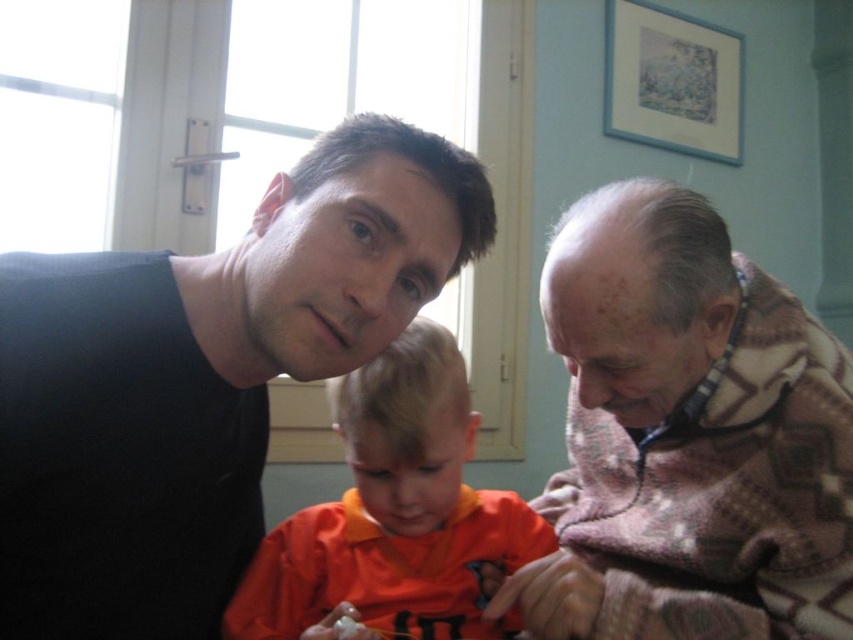
You are trying to determine which of the two knitted items is closer to you in the image. The scene shows a family photo with two adults and a child. The objects in question are the knitted sweater at right and the knitted wool sweater at right. Which one is closer to the observer?

The knitted sweater at right is closer to the observer because it is in front of the knitted wool sweater at right.

You are a tailor trying to decide which item to place on a narrow tailor stand. Based on the image, which item between the knitted wool sweater at right and the orange fabric shirt at center would you choose to avoid it falling off the stand?

The orange fabric shirt at center should be chosen because the knitted wool sweater at right might be wider and more likely to fall off the narrow tailor stand.